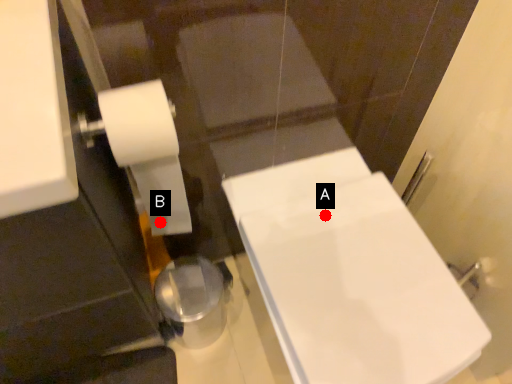
Question: Two points are circled on the image, labeled by A and B beside each circle. Which point is further to the camera?

Choices:
 (A) A is further
 (B) B is further

Answer: (B)